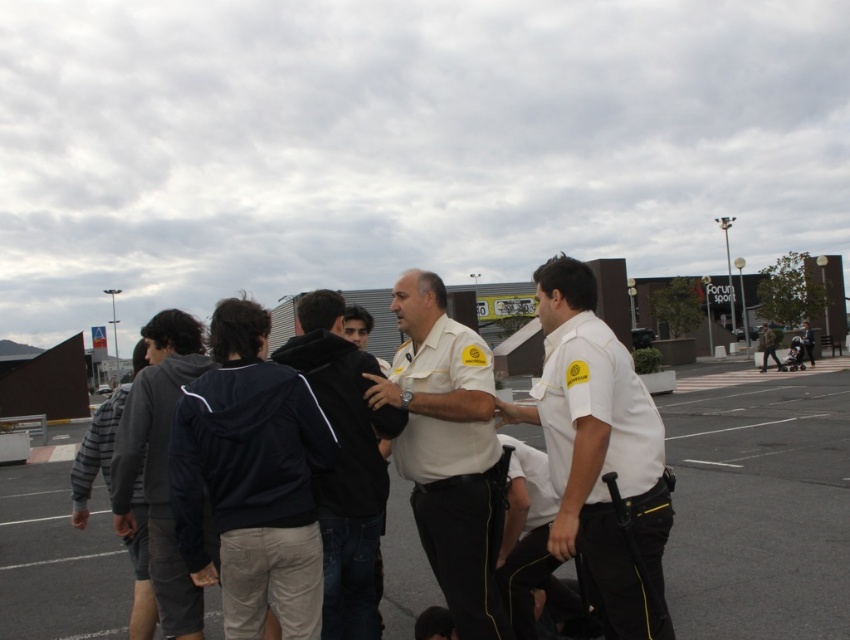
You are a photographer setting up a camera to capture the scene of the white uniform at center and the dark gray hoodie at left. The camera has a fixed width setting that can only accommodate objects of equal or wider width than the widest object in the scene. Which object should you ensure fits within the camera frame first?

The dark gray hoodie at left has a greater width than the white uniform at center, so you should ensure the dark gray hoodie at left fits within the camera frame first to accommodate its wider size.

You are a delivery person trying to navigate between the dark blue jacket at center and the dark gray hoodie at left to reach the dropoff point. The delivery cart you are pushing has a width of 3 feet. Can you safely pass through the space between them without hitting either?

The distance between the dark blue jacket at center and the dark gray hoodie at left is 4.33 feet. Since the delivery cart is 3 feet wide, there is enough space to pass safely as 3 feet is less than 4.33 feet.